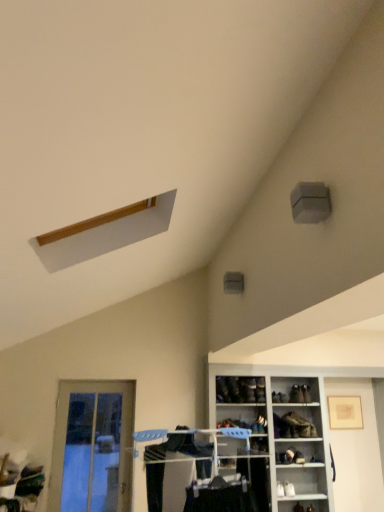
Question: Can you confirm if matte plastic clothes rack at lower center is thinner than dark brown leather shoe at lower center, the 1th shoe from the left?

Choices:
 (A) yes
 (B) no

Answer: (B)

Question: Is matte plastic clothes rack at lower center next to dark brown leather shoe at lower center, the 1th shoe from the left?

Choices:
 (A) yes
 (B) no

Answer: (B)

Question: Can you confirm if matte plastic clothes rack at lower center is smaller than dark brown leather shoe at lower center, the 4th shoe from the right?

Choices:
 (A) no
 (B) yes

Answer: (A)

Question: From a real-world perspective, is matte plastic clothes rack at lower center under dark brown leather shoe at lower center, the 4th shoe from the right?

Choices:
 (A) no
 (B) yes

Answer: (B)

Question: Is matte plastic clothes rack at lower center not close to dark brown leather shoe at lower center, the 4th shoe from the right?

Choices:
 (A) no
 (B) yes

Answer: (B)

Question: In terms of width, does white glossy shoe rack at lower right, the 1th shelf when ordered from right to left, look wider or thinner when compared to leather shoe at lower center, which is the 1th shoe from right to left?

Choices:
 (A) thin
 (B) wide

Answer: (B)

Question: From their relative heights in the image, would you say white glossy shoe rack at lower right, the 1th shelf when ordered from right to left, is taller or shorter than leather shoe at lower center, which is the 1th shoe from right to left?

Choices:
 (A) tall
 (B) short

Answer: (A)

Question: From a real-world perspective, is white glossy shoe rack at lower right, the 1th shelf when ordered from right to left, positioned above or below leather shoe at lower center, the fourth shoe from the left?

Choices:
 (A) below
 (B) above

Answer: (A)

Question: In the image, is white glossy shoe rack at lower right, the 1th shelf when ordered from right to left, positioned in front of or behind leather shoe at lower center, which is the 1th shoe from right to left?

Choices:
 (A) behind
 (B) front

Answer: (B)

Question: From the image's perspective, is matte black shoe at lower center, positioned as the 1th shelf in left-to-right order, above or below dark brown leather shoe at lower center, the 4th shoe from the right?

Choices:
 (A) above
 (B) below

Answer: (B)

Question: Is matte black shoe at lower center, arranged as the second shelf when viewed from the right, wider or thinner than dark brown leather shoe at lower center, the 1th shoe from the left?

Choices:
 (A) wide
 (B) thin

Answer: (A)

Question: From a real-world perspective, relative to dark brown leather shoe at lower center, the 4th shoe from the right, is matte black shoe at lower center, arranged as the second shelf when viewed from the right, vertically above or below?

Choices:
 (A) below
 (B) above

Answer: (A)

Question: Is matte black shoe at lower center, positioned as the 1th shelf in left-to-right order, spatially inside dark brown leather shoe at lower center, the 1th shoe from the left, or outside of it?

Choices:
 (A) outside
 (B) inside

Answer: (A)

Question: Is point (259, 374) closer or farther from the camera than point (284, 420)?

Choices:
 (A) farther
 (B) closer

Answer: (B)

Question: In terms of height, does white glossy shoe rack at lower right, the 1th shelf when ordered from right to left, look taller or shorter compared to matte black shoe at lower center, arranged as the second shelf when viewed from the right?

Choices:
 (A) short
 (B) tall

Answer: (B)